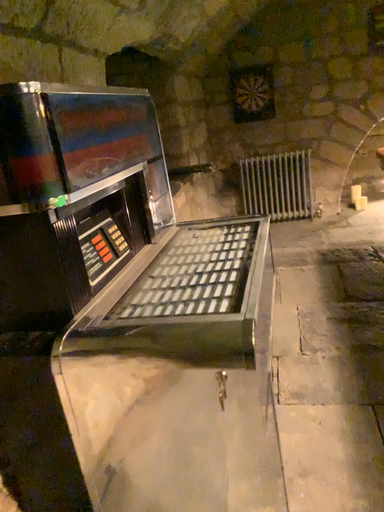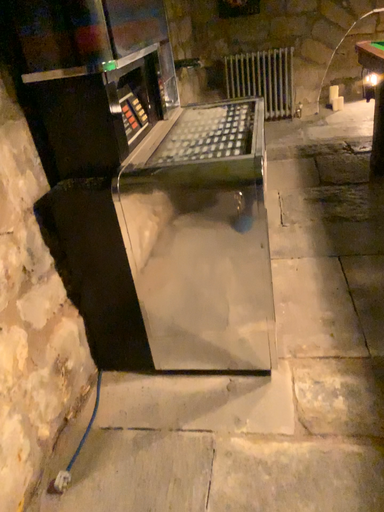
Question: How did the camera likely rotate when shooting the video?

Choices:
 (A) rotated upward
 (B) rotated downward

Answer: (B)